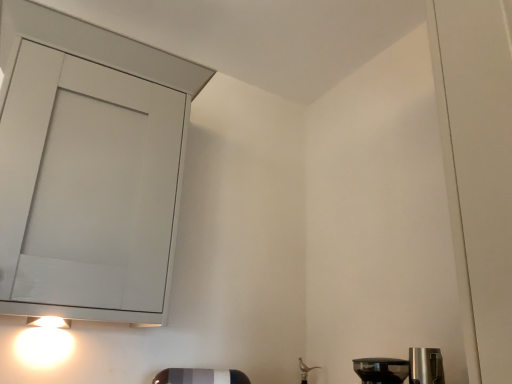
Question: Is transparent plastic coffee maker at lower right turned away from white glossy light at lower left?

Choices:
 (A) no
 (B) yes

Answer: (A)

Question: Is transparent plastic coffee maker at lower right shorter than white glossy light at lower left?

Choices:
 (A) yes
 (B) no

Answer: (A)

Question: From a real-world perspective, is transparent plastic coffee maker at lower right on white glossy light at lower left?

Choices:
 (A) yes
 (B) no

Answer: (B)

Question: From the image's perspective, is transparent plastic coffee maker at lower right beneath white glossy light at lower left?

Choices:
 (A) yes
 (B) no

Answer: (A)

Question: From the image's perspective, is transparent plastic coffee maker at lower right above white glossy light at lower left?

Choices:
 (A) yes
 (B) no

Answer: (B)

Question: Considering the positions of matte white cabinet at upper left and transparent plastic coffee maker at lower right in the image, is matte white cabinet at upper left taller or shorter than transparent plastic coffee maker at lower right?

Choices:
 (A) short
 (B) tall

Answer: (B)

Question: Considering the positions of matte white cabinet at upper left and transparent plastic coffee maker at lower right in the image, is matte white cabinet at upper left wider or thinner than transparent plastic coffee maker at lower right?

Choices:
 (A) thin
 (B) wide

Answer: (B)

Question: In the image, is matte white cabinet at upper left on the left side or the right side of transparent plastic coffee maker at lower right?

Choices:
 (A) right
 (B) left

Answer: (B)

Question: Is matte white cabinet at upper left bigger or smaller than transparent plastic coffee maker at lower right?

Choices:
 (A) small
 (B) big

Answer: (B)

Question: Looking at their shapes, would you say white glossy light at lower left is wider or thinner than transparent plastic coffee maker at lower right?

Choices:
 (A) thin
 (B) wide

Answer: (A)

Question: Based on their sizes in the image, would you say white glossy light at lower left is bigger or smaller than transparent plastic coffee maker at lower right?

Choices:
 (A) small
 (B) big

Answer: (B)

Question: From a real-world perspective, is white glossy light at lower left above or below transparent plastic coffee maker at lower right?

Choices:
 (A) below
 (B) above

Answer: (B)

Question: Is white glossy light at lower left in front of or behind transparent plastic coffee maker at lower right in the image?

Choices:
 (A) behind
 (B) front

Answer: (A)

Question: Looking at the image, does transparent plastic coffee maker at lower right seem bigger or smaller compared to matte white cabinet at upper left?

Choices:
 (A) big
 (B) small

Answer: (B)

Question: Do you think transparent plastic coffee maker at lower right is within matte white cabinet at upper left, or outside of it?

Choices:
 (A) outside
 (B) inside

Answer: (A)